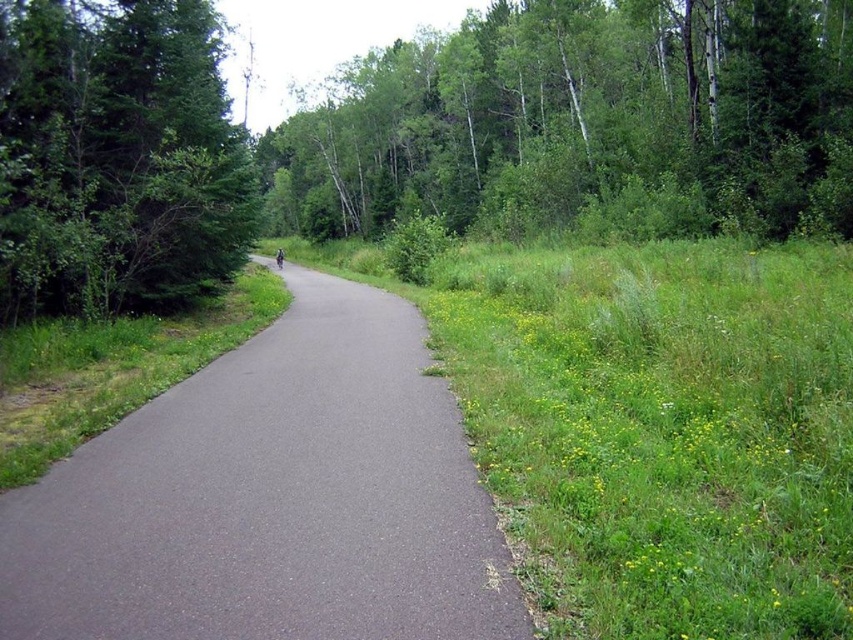
Who is higher up, green leafy trees at upper center or green leafy tree at left?

green leafy trees at upper center is higher up.

Does point (450, 61) come behind point (97, 234)?

Yes, point (450, 61) is behind point (97, 234).

Between point (843, 144) and point (105, 125), which one is positioned behind?

Positioned behind is point (843, 144).

I want to click on green leafy trees at upper center, so click(583, 124).

Who is positioned more to the left, gray asphalt trail at center or green leafy trees at upper center?

From the viewer's perspective, green leafy trees at upper center appears more on the left side.

Is gray asphalt trail at center positioned in front of green leafy trees at upper center?

Yes.

Locate an element on the screen. This screenshot has width=853, height=640. gray asphalt trail at center is located at coordinates (271, 499).

Who is taller, gray asphalt trail at center or green leafy tree at left?

green leafy tree at left

Looking at this image, is gray asphalt trail at center shorter than green leafy tree at left?

Indeed, gray asphalt trail at center has a lesser height compared to green leafy tree at left.

The image size is (853, 640). Identify the location of gray asphalt trail at center. (271, 499).

Find the location of `gray asphalt trail at center`. gray asphalt trail at center is located at coordinates (271, 499).